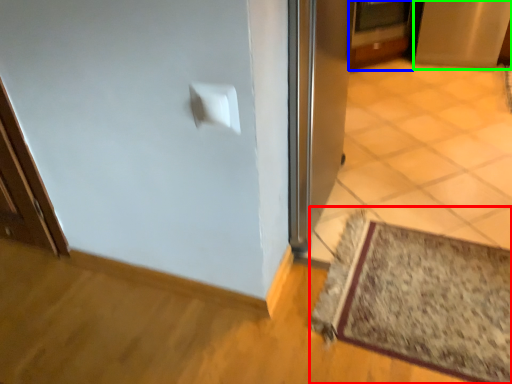
Question: Estimate the real-world distances between objects in this image. Which object is closer to mat (highlighted by a red box), door (highlighted by a blue box) or screen door (highlighted by a green box)?

Choices:
 (A) door
 (B) screen door

Answer: (A)